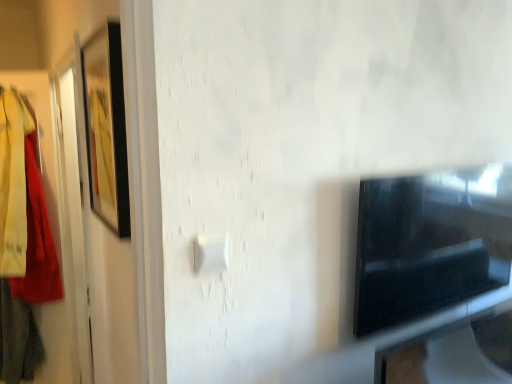
Question: Is black glossy tv at right looking in the opposite direction of white plastic light switch at center?

Choices:
 (A) no
 (B) yes

Answer: (A)

Question: Considering the relative sizes of black glossy tv at right and white plastic light switch at center in the image provided, is black glossy tv at right thinner than white plastic light switch at center?

Choices:
 (A) no
 (B) yes

Answer: (A)

Question: Is black glossy tv at right completely or partially outside of white plastic light switch at center?

Choices:
 (A) no
 (B) yes

Answer: (B)

Question: From a real-world perspective, does black glossy tv at right sit lower than white plastic light switch at center?

Choices:
 (A) yes
 (B) no

Answer: (A)

Question: Can you confirm if black glossy tv at right is positioned to the right of white plastic light switch at center?

Choices:
 (A) no
 (B) yes

Answer: (B)

Question: Considering the positions of black glossy tv at right and white plastic light switch at center in the image, is black glossy tv at right bigger or smaller than white plastic light switch at center?

Choices:
 (A) big
 (B) small

Answer: (A)

Question: From the image's perspective, relative to white plastic light switch at center, is black glossy tv at right above or below?

Choices:
 (A) above
 (B) below

Answer: (B)

Question: Considering the positions of black glossy tv at right and white plastic light switch at center in the image, is black glossy tv at right wider or thinner than white plastic light switch at center?

Choices:
 (A) wide
 (B) thin

Answer: (A)

Question: Is black glossy tv at right in front of or behind white plastic light switch at center in the image?

Choices:
 (A) front
 (B) behind

Answer: (B)

Question: Looking at their shapes, would you say matte black picture frame at left is wider or thinner than white plastic light switch at center?

Choices:
 (A) thin
 (B) wide

Answer: (B)

Question: From a real-world perspective, is matte black picture frame at left positioned above or below white plastic light switch at center?

Choices:
 (A) above
 (B) below

Answer: (A)

Question: In the image, is matte black picture frame at left on the left side or the right side of white plastic light switch at center?

Choices:
 (A) left
 (B) right

Answer: (A)

Question: Is matte black picture frame at left in front of or behind white plastic light switch at center in the image?

Choices:
 (A) behind
 (B) front

Answer: (A)

Question: Looking at their shapes, would you say white plastic light switch at center is wider or thinner than matte black picture frame at left?

Choices:
 (A) wide
 (B) thin

Answer: (B)

Question: In the image, is white plastic light switch at center positioned in front of or behind matte black picture frame at left?

Choices:
 (A) front
 (B) behind

Answer: (A)